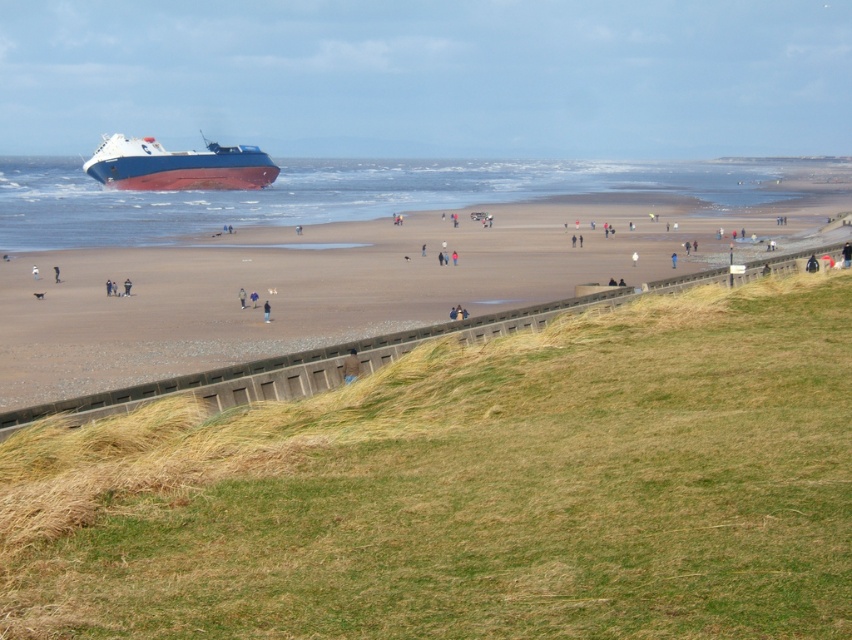
Which is above, brown sandy beach at upper center or blue matte ship at upper left?

blue matte ship at upper left is above.

Does brown sandy beach at upper center lie behind blue matte ship at upper left?

No, brown sandy beach at upper center is in front of blue matte ship at upper left.

Who is more distant from viewer, (x=753, y=211) or (x=165, y=188)?

The point (x=165, y=188) is behind.

Where is `brown sandy beach at upper center`? The image size is (852, 640). brown sandy beach at upper center is located at coordinates (326, 285).

Does brown sandy beach at upper center have a smaller size compared to brown fuzzy jacket at lower center?

Incorrect, brown sandy beach at upper center is not smaller in size than brown fuzzy jacket at lower center.

Is brown sandy beach at upper center wider than brown fuzzy jacket at lower center?

Yes.

Find the location of a particular element. This screenshot has height=640, width=852. brown sandy beach at upper center is located at coordinates (326, 285).

In order to click on brown sandy beach at upper center in this screenshot , I will do `click(326, 285)`.

Looking at this image, does blue matte ship at upper left appear on the right side of brown fuzzy jacket at lower center?

Incorrect, blue matte ship at upper left is not on the right side of brown fuzzy jacket at lower center.

Does point (268, 172) come closer to viewer compared to point (355, 372)?

No, (268, 172) is behind (355, 372).

This screenshot has height=640, width=852. I want to click on blue matte ship at upper left, so 177,164.